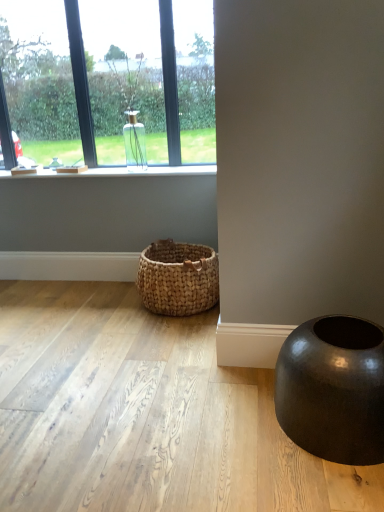
Question: From the image's perspective, is clear glass vase at upper left, the 2th window when ordered from left to right, on shiny black vase at lower right?

Choices:
 (A) yes
 (B) no

Answer: (A)

Question: Can you confirm if clear glass vase at upper left, which is the first window from right to left, is shorter than shiny black vase at lower right?

Choices:
 (A) yes
 (B) no

Answer: (B)

Question: Is clear glass vase at upper left, which is the first window from right to left, at the right side of shiny black vase at lower right?

Choices:
 (A) no
 (B) yes

Answer: (A)

Question: Can you confirm if clear glass vase at upper left, which is the first window from right to left, is taller than shiny black vase at lower right?

Choices:
 (A) no
 (B) yes

Answer: (B)

Question: Is clear glass vase at upper left, the 2th window when ordered from left to right, not inside shiny black vase at lower right?

Choices:
 (A) yes
 (B) no

Answer: (A)

Question: From their relative heights in the image, would you say clear glass vase at upper left, which is the 2th window in right-to-left order, is taller or shorter than woven natural basket at lower center?

Choices:
 (A) tall
 (B) short

Answer: (A)

Question: In terms of size, does clear glass vase at upper left, which is the 1th window from left to right, appear bigger or smaller than woven natural basket at lower center?

Choices:
 (A) small
 (B) big

Answer: (B)

Question: Is point (82, 83) positioned closer to the camera than point (206, 258)?

Choices:
 (A) closer
 (B) farther

Answer: (B)

Question: Considering the relative positions of clear glass vase at upper left, which is the 2th window in right-to-left order, and woven natural basket at lower center in the image provided, is clear glass vase at upper left, which is the 2th window in right-to-left order, to the left or to the right of woven natural basket at lower center?

Choices:
 (A) left
 (B) right

Answer: (A)

Question: Is clear glass vase at upper left bigger or smaller than woven natural basket at lower center?

Choices:
 (A) small
 (B) big

Answer: (A)

Question: Is clear glass vase at upper left inside the boundaries of woven natural basket at lower center, or outside?

Choices:
 (A) inside
 (B) outside

Answer: (B)

Question: Looking at their shapes, would you say clear glass vase at upper left is wider or thinner than woven natural basket at lower center?

Choices:
 (A) wide
 (B) thin

Answer: (B)

Question: From the image's perspective, is clear glass vase at upper left located above or below woven natural basket at lower center?

Choices:
 (A) below
 (B) above

Answer: (B)

Question: In terms of height, does clear glass vase at upper left, which is the 1th window from left to right, look taller or shorter compared to clear glass vase at upper left, which is the first window from right to left?

Choices:
 (A) tall
 (B) short

Answer: (A)

Question: Is clear glass vase at upper left, which is the 1th window from left to right, in front of or behind clear glass vase at upper left, the 2th window when ordered from left to right, in the image?

Choices:
 (A) front
 (B) behind

Answer: (B)